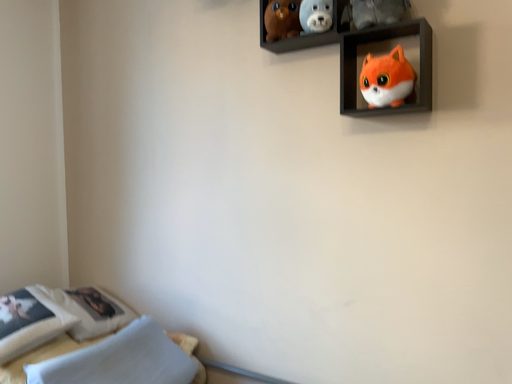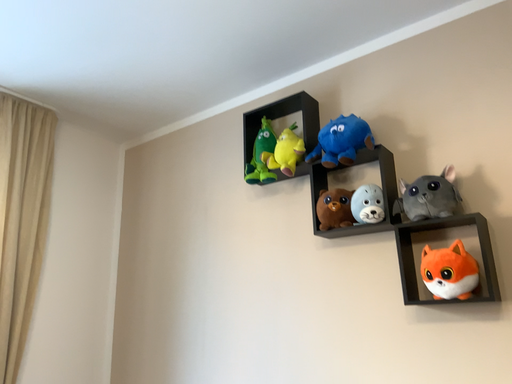
Question: Which way did the camera rotate in the video?

Choices:
 (A) rotated upward
 (B) rotated downward

Answer: (A)